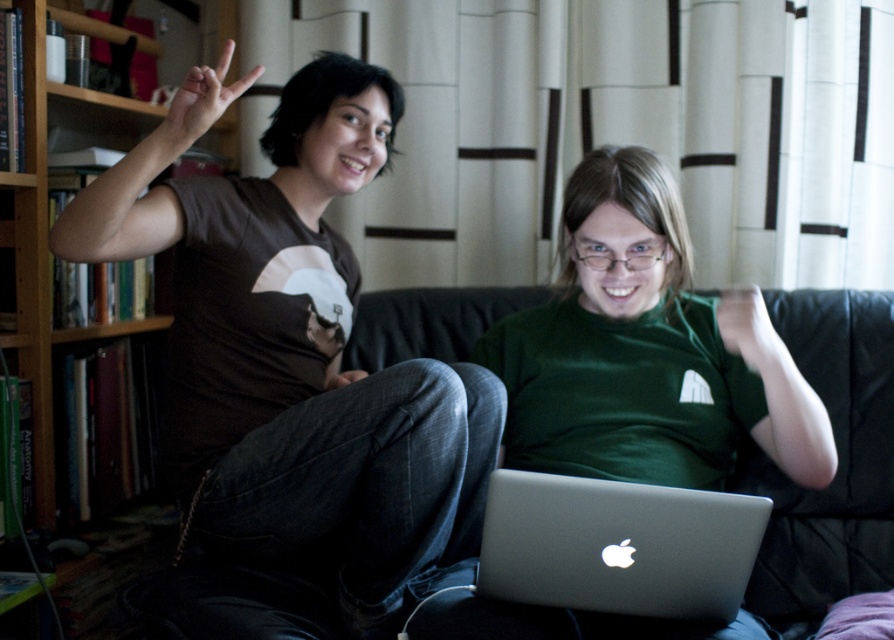
In the scene shown: You are a delivery robot with a package that is 1.0 meters wide. You need to move from the silver metallic laptop at center to the wooden bookshelf at left. Is there enough space for you to pass through the gap between them?

The distance between the silver metallic laptop at center and the wooden bookshelf at left is 1.09 meters, which is slightly wider than the robot package of 1.0 meters. The robot can pass through the gap between them.